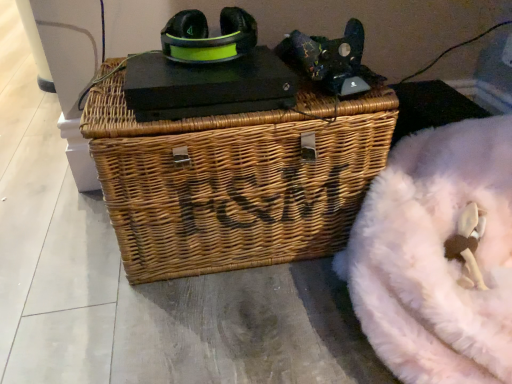
Question: Are woven brown picnic basket at center and velvet-like pink bean bag at upper right, positioned as the 1th bean bag chair in top-to-bottom order, beside each other?

Choices:
 (A) no
 (B) yes

Answer: (A)

Question: Is velvet-like pink bean bag at upper right, positioned as the 1th bean bag chair in top-to-bottom order, at the back of woven brown picnic basket at center?

Choices:
 (A) no
 (B) yes

Answer: (A)

Question: From a real-world perspective, does woven brown picnic basket at center stand above velvet-like pink bean bag at upper right, positioned as the 1th bean bag chair in top-to-bottom order?

Choices:
 (A) yes
 (B) no

Answer: (B)

Question: Could you tell me if woven brown picnic basket at center is facing velvet-like pink bean bag at upper right, positioned as the 1th bean bag chair in top-to-bottom order?

Choices:
 (A) no
 (B) yes

Answer: (A)

Question: Is woven brown picnic basket at center not within velvet-like pink bean bag at upper right, acting as the 2th bean bag chair starting from the bottom?

Choices:
 (A) yes
 (B) no

Answer: (A)

Question: Is woven brown picnic basket at center positioned behind velvet-like pink bean bag at upper right, acting as the 2th bean bag chair starting from the bottom?

Choices:
 (A) yes
 (B) no

Answer: (B)

Question: From a real-world perspective, is matte green plastic headphones at upper center beneath woven brown picnic basket at center?

Choices:
 (A) no
 (B) yes

Answer: (A)

Question: From a real-world perspective, is matte green plastic headphones at upper center located higher than woven brown picnic basket at center?

Choices:
 (A) yes
 (B) no

Answer: (A)

Question: Does matte green plastic headphones at upper center appear on the right side of woven brown picnic basket at center?

Choices:
 (A) yes
 (B) no

Answer: (B)

Question: Is there a large distance between matte green plastic headphones at upper center and woven brown picnic basket at center?

Choices:
 (A) yes
 (B) no

Answer: (B)

Question: Considering the relative sizes of matte green plastic headphones at upper center and woven brown picnic basket at center in the image provided, is matte green plastic headphones at upper center thinner than woven brown picnic basket at center?

Choices:
 (A) no
 (B) yes

Answer: (B)

Question: Considering the relative sizes of matte green plastic headphones at upper center and woven brown picnic basket at center in the image provided, is matte green plastic headphones at upper center shorter than woven brown picnic basket at center?

Choices:
 (A) yes
 (B) no

Answer: (A)

Question: Considering the relative sizes of velvet-like pink bean bag at upper right, acting as the 2th bean bag chair starting from the bottom, and matte green plastic headphones at upper center in the image provided, is velvet-like pink bean bag at upper right, acting as the 2th bean bag chair starting from the bottom, wider than matte green plastic headphones at upper center?

Choices:
 (A) yes
 (B) no

Answer: (B)